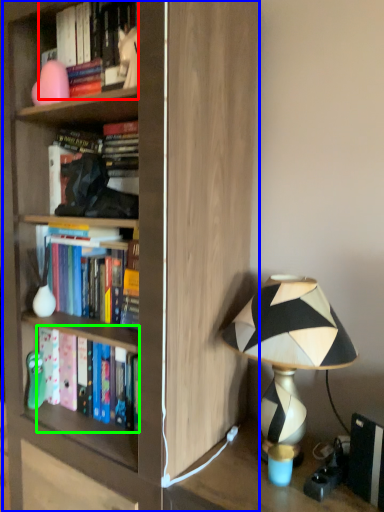
Question: Considering the real-world distances, which object is closest to book (highlighted by a red box)? bookcase (highlighted by a blue box) or book (highlighted by a green box).

Choices:
 (A) bookcase
 (B) book

Answer: (A)